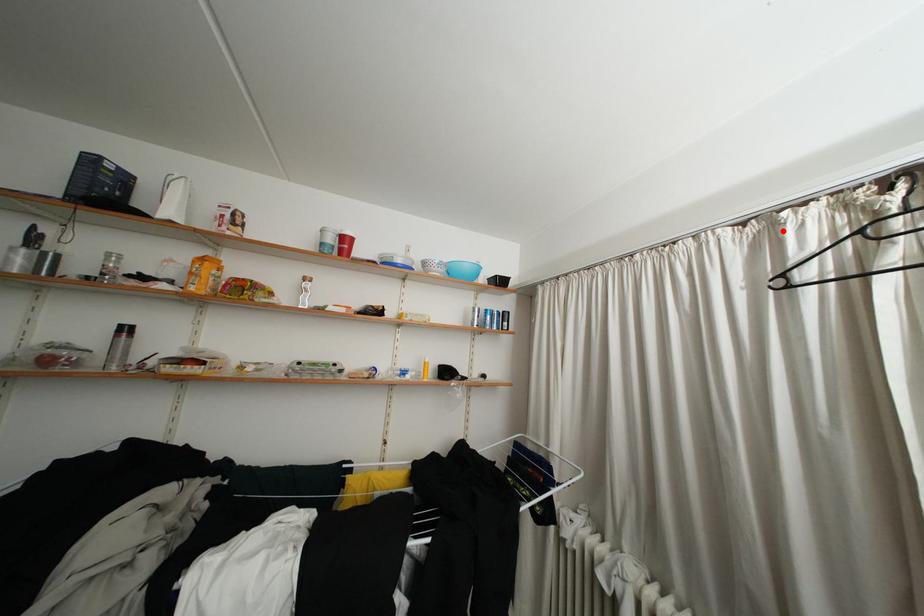
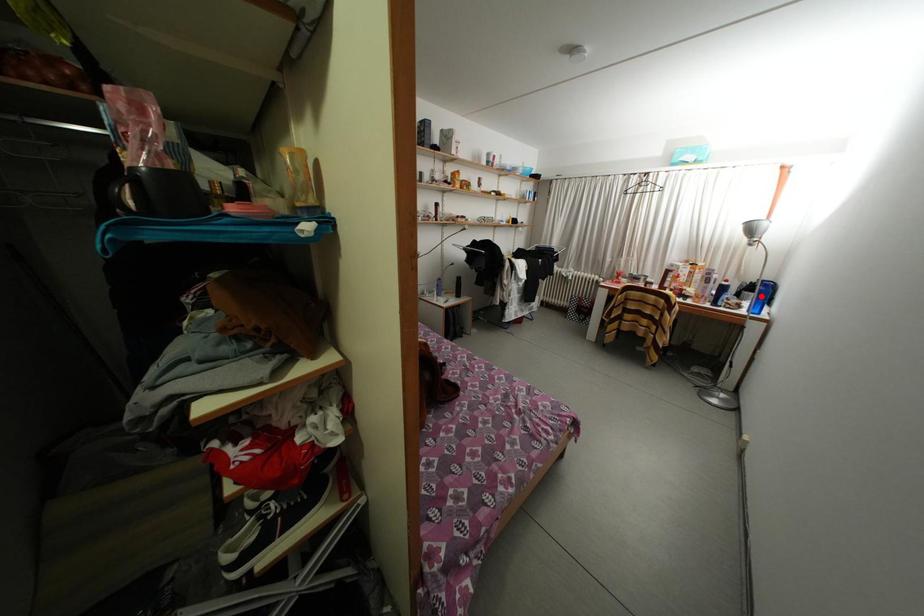
I am providing you with two images of the same scene from different viewpoints. A red point is marked on the first image and another point is marked on the second image. Does the point marked in image1 correspond to the same location as the one in image2?

No